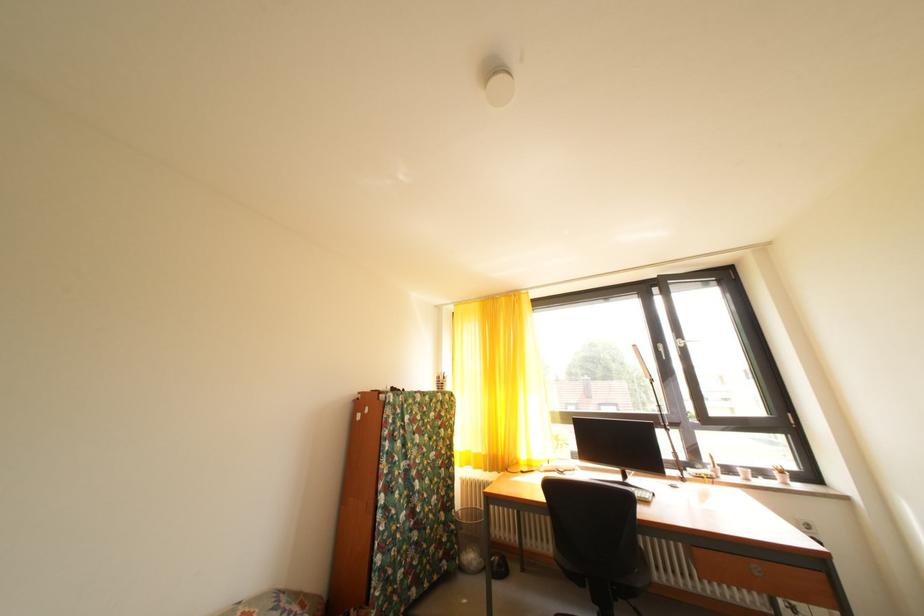
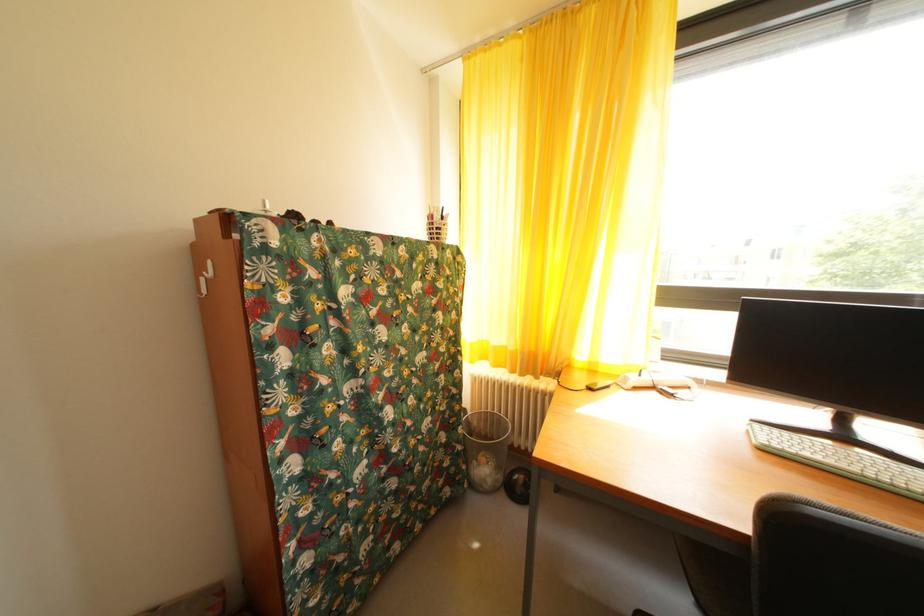
Find the pixel in the second image that matches point (484, 461) in the first image.

(505, 354)